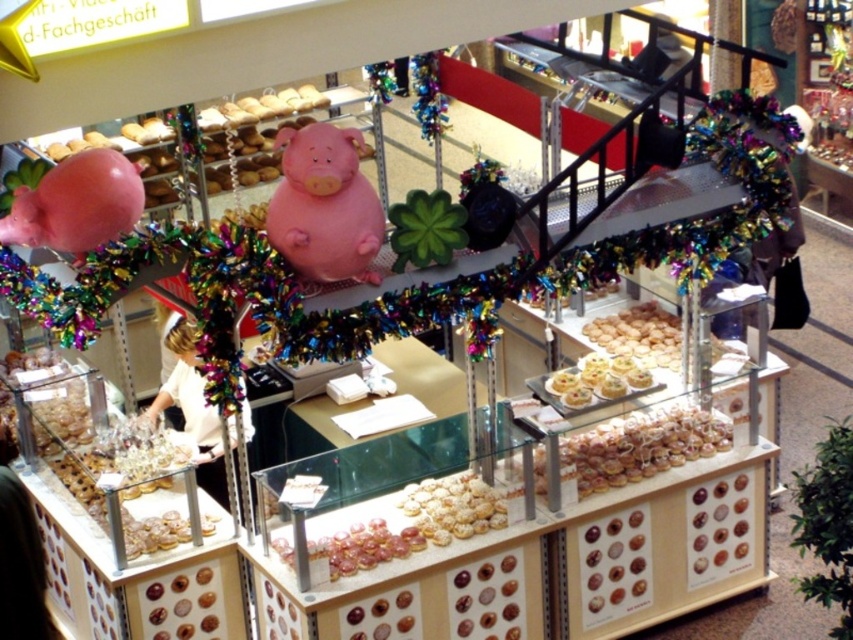
Question: Does pink matte balloon at left have a larger size compared to glazed doughnut at center?

Choices:
 (A) no
 (B) yes

Answer: (A)

Question: Which object is the closest to the glazed sugar cookie at center?

Choices:
 (A) golden glazed cookies at center
 (B) pink matte balloon at left

Answer: (A)

Question: Which point is farther from the camera taking this photo?

Choices:
 (A) (590, 360)
 (B) (341, 252)
 (C) (25, 244)

Answer: (A)

Question: In this image, where is pink matte balloon at left located relative to glazed sugar cookie at center?

Choices:
 (A) right
 (B) left

Answer: (B)

Question: Can you confirm if pink matte piggy bank at center is positioned above glazed doughnut at center?

Choices:
 (A) no
 (B) yes

Answer: (B)

Question: Which object is closer to the camera taking this photo?

Choices:
 (A) glazed sugar cookie at center
 (B) pink matte balloon at left
 (C) pink matte piggy bank at center
 (D) golden glazed cookies at center

Answer: (C)